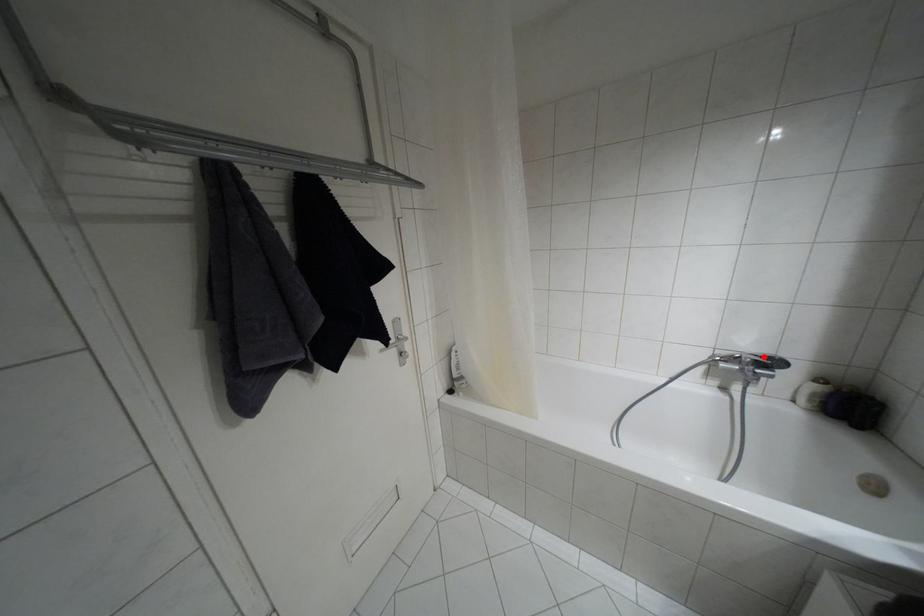
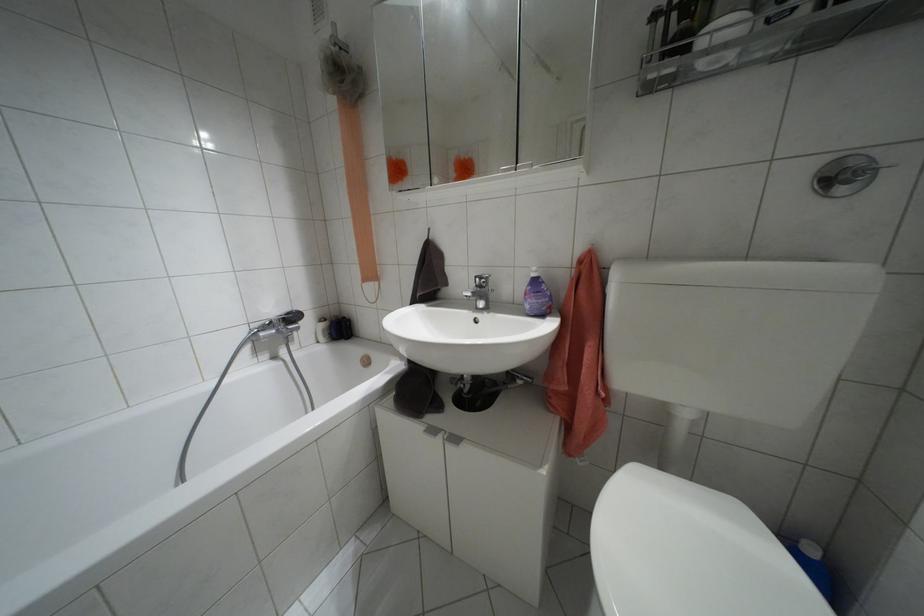
Where in the second image is the point corresponding to the highlighted location from the first image?

(286, 313)